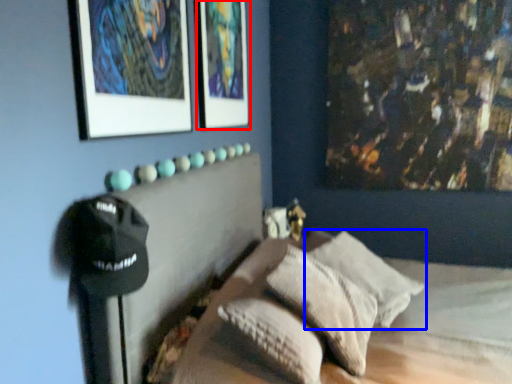
Question: Which point is closer to the camera, picture frame (highlighted by a red box) or pillow (highlighted by a blue box)?

Choices:
 (A) picture frame
 (B) pillow

Answer: (B)